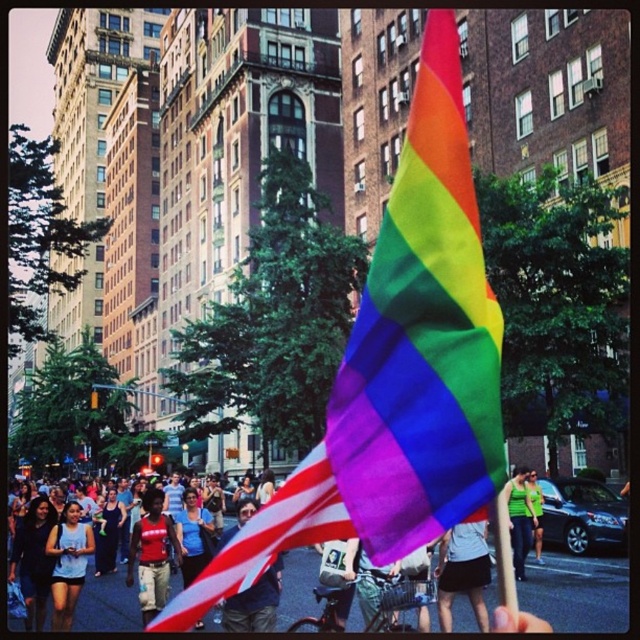
You are a photographer trying to capture both the american flag at center and the green fabric shirt at center in the same frame. Based on their sizes, which object should you focus on to ensure both are clearly visible?

The american flag at center is larger in size than the green fabric shirt at center, so you should focus on the american flag at center to ensure both are clearly visible.

In the scene shown: You are a photographer trying to capture a photo of the red fabric shirt at center and the green fabric shirt at center. Which shirt should you focus on first if you want to capture them in order from left to right?

The red fabric shirt at center should be focused on first because it is positioned on the left side of the green fabric shirt at center.

You are standing in the middle of the street during the parade and see two points marked in the image. Which point, point (244, 592) or point (531, 506), is closer to you?

Point (244, 592) is closer to you than point (531, 506).